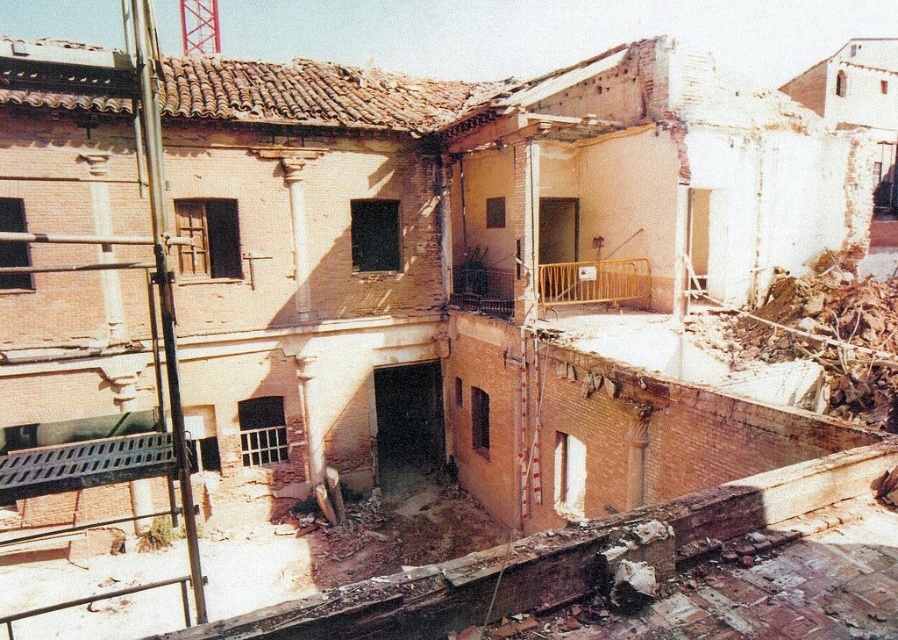
Question: Which point is farther from the camera taking this photo?

Choices:
 (A) (507, 305)
 (B) (25, 493)

Answer: (A)

Question: Is metallic grid at lower left above yellow metallic railing at center?

Choices:
 (A) no
 (B) yes

Answer: (A)

Question: Which point is farther from the camera taking this photo?

Choices:
 (A) (41, 458)
 (B) (476, 289)

Answer: (B)

Question: Does metallic grid at lower left have a greater width compared to yellow metallic railing at center?

Choices:
 (A) yes
 (B) no

Answer: (B)

Question: Observing the image, what is the correct spatial positioning of metallic grid at lower left in reference to yellow metallic railing at center?

Choices:
 (A) right
 (B) left

Answer: (B)